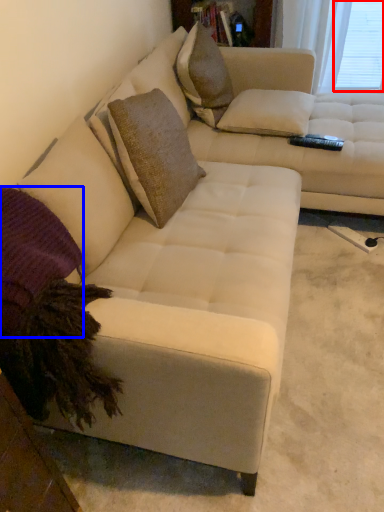
Question: Which point is closer to the camera, window screen (highlighted by a red box) or pillow (highlighted by a blue box)?

Choices:
 (A) window screen
 (B) pillow

Answer: (B)